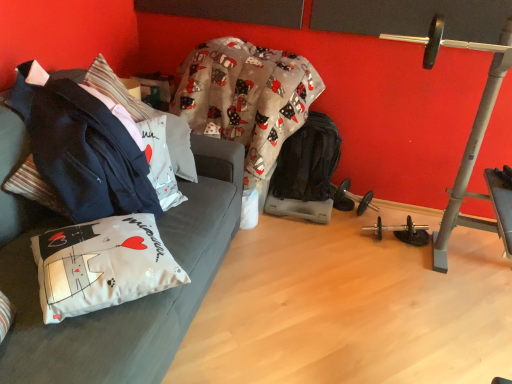
At what (x,y) coordinates should I click in order to perform the action: click on dark blue fabric jacket at left. Please return your answer as a coordinate pair (x, y). Looking at the image, I should click on (80, 151).

What do you see at coordinates (146, 116) in the screenshot?
I see `white fabric pillow at center, which is the 2th pillow from bottom to top` at bounding box center [146, 116].

I want to click on white fabric pillow at lower left, the first pillow positioned from the front, so click(x=102, y=265).

Can you tell me how much white fabric pillow at lower left, marked as the second pillow in a back-to-front arrangement, and patterned fabric blanket at center differ in facing direction?

The facing directions of white fabric pillow at lower left, marked as the second pillow in a back-to-front arrangement, and patterned fabric blanket at center are 133 degrees apart.

Which object is positioned more to the left, white fabric pillow at lower left, marked as the second pillow in a back-to-front arrangement, or patterned fabric blanket at center?

Positioned to the left is white fabric pillow at lower left, marked as the second pillow in a back-to-front arrangement.

Which of these two, white fabric pillow at lower left, marked as the second pillow in a back-to-front arrangement, or patterned fabric blanket at center, is bigger?

patterned fabric blanket at center is bigger.

Choose the correct answer: Is white fabric pillow at lower left, which is counted as the 1th pillow, starting from the bottom, inside patterned fabric blanket at center or outside it?

white fabric pillow at lower left, which is counted as the 1th pillow, starting from the bottom, is located beyond the bounds of patterned fabric blanket at center.

Based on the photo, does dark blue fabric jacket at left have a greater width compared to white fabric couch at left?

No.

Is dark blue fabric jacket at left aimed at white fabric couch at left?

Yes, dark blue fabric jacket at left faces towards white fabric couch at left.

The image size is (512, 384). In the image, there is a dark blue fabric jacket at left. Identify the location of studio couch below it (from the image's perspective). (128, 302).

Is dark blue fabric jacket at left outside of white fabric couch at left?

No, dark blue fabric jacket at left is not outside of white fabric couch at left.

Is white fabric pillow at lower left, marked as the second pillow in a back-to-front arrangement, surrounded by black rubber dumbbell at lower center?

That's incorrect, white fabric pillow at lower left, marked as the second pillow in a back-to-front arrangement, is not inside black rubber dumbbell at lower center.

Is the position of black rubber dumbbell at lower center less distant than that of white fabric pillow at lower left, the first pillow positioned from the front?

No, black rubber dumbbell at lower center is behind white fabric pillow at lower left, the first pillow positioned from the front.

Could you tell me if black rubber dumbbell at lower center is facing white fabric pillow at lower left, marked as the second pillow in a back-to-front arrangement?

Yes, black rubber dumbbell at lower center is oriented towards white fabric pillow at lower left, marked as the second pillow in a back-to-front arrangement.

From a real-world perspective, is black rubber dumbbell at lower center on white fabric pillow at lower left, marked as the second pillow in a back-to-front arrangement?

Actually, black rubber dumbbell at lower center is physically below white fabric pillow at lower left, marked as the second pillow in a back-to-front arrangement, in the real world.

Is patterned fabric blanket at center outside of white fabric pillow at center, the 2th pillow viewed from the front?

patterned fabric blanket at center lies outside white fabric pillow at center, the 2th pillow viewed from the front,'s area.

Is patterned fabric blanket at center directly adjacent to white fabric pillow at center, which is the first pillow from top to bottom?

patterned fabric blanket at center and white fabric pillow at center, which is the first pillow from top to bottom, are clearly separated.

Is patterned fabric blanket at center looking in the opposite direction of white fabric pillow at center, which is the 2th pillow from bottom to top?

That's not correct — patterned fabric blanket at center is not looking away from white fabric pillow at center, which is the 2th pillow from bottom to top.

Can you confirm if patterned fabric blanket at center is bigger than white fabric pillow at center, which is the first pillow from top to bottom?

Correct, patterned fabric blanket at center is larger in size than white fabric pillow at center, which is the first pillow from top to bottom.

Is there a large distance between white fabric pillow at center, which is the first pillow from top to bottom, and white fabric couch at left?

white fabric pillow at center, which is the first pillow from top to bottom, is actually quite close to white fabric couch at left.

Locate an element on the screen. Image resolution: width=512 pixels, height=384 pixels. studio couch below the white fabric pillow at center, which is the first pillow from top to bottom (from the image's perspective) is located at coordinates (128, 302).

Can you confirm if white fabric pillow at center, positioned as the first pillow in back-to-front order, is thinner than white fabric couch at left?

Yes, white fabric pillow at center, positioned as the first pillow in back-to-front order, is thinner than white fabric couch at left.

Considering the sizes of objects white fabric pillow at lower left, marked as the second pillow in a back-to-front arrangement, and dark blue fabric jacket at left in the image provided, who is smaller, white fabric pillow at lower left, marked as the second pillow in a back-to-front arrangement, or dark blue fabric jacket at left?

Smaller between the two is white fabric pillow at lower left, marked as the second pillow in a back-to-front arrangement.

Which object is closer to the camera taking this photo, white fabric pillow at lower left, the second pillow when ordered from top to bottom, or dark blue fabric jacket at left?

white fabric pillow at lower left, the second pillow when ordered from top to bottom, is closer to the camera.

From a real-world perspective, relative to dark blue fabric jacket at left, is white fabric pillow at lower left, the second pillow when ordered from top to bottom, vertically above or below?

white fabric pillow at lower left, the second pillow when ordered from top to bottom, is below dark blue fabric jacket at left.

Which of these two, white fabric pillow at lower left, which is counted as the 1th pillow, starting from the bottom, or dark blue fabric jacket at left, is wider?

white fabric pillow at lower left, which is counted as the 1th pillow, starting from the bottom.

The height and width of the screenshot is (384, 512). What are the coordinates of `jacket behind the white fabric pillow at lower left, the first pillow positioned from the front` in the screenshot? It's located at (80, 151).

Considering the positions of point (105, 213) and point (151, 239), is point (105, 213) closer or farther from the camera than point (151, 239)?

Point (105, 213) is farther from the camera than point (151, 239).

Does dark blue fabric jacket at left have a lesser width compared to white fabric pillow at lower left, the first pillow positioned from the front?

Correct, the width of dark blue fabric jacket at left is less than that of white fabric pillow at lower left, the first pillow positioned from the front.

From the image's perspective, which is above, dark blue fabric jacket at left or white fabric pillow at lower left, which is counted as the 1th pillow, starting from the bottom?

dark blue fabric jacket at left is shown above in the image.

Find the location of a particular element. Image resolution: width=512 pixels, height=384 pixels. the 1st pillow to the left of the patterned fabric blanket at center, counting from the anchor's position is located at coordinates (102, 265).

At what (x,y) coordinates should I click in order to perform the action: click on jacket behind the white fabric couch at left. Please return your answer as a coordinate pair (x, y). Looking at the image, I should click on tap(80, 151).

Consider the image. Based on their spatial positions, is white fabric pillow at lower left, which is counted as the 1th pillow, starting from the bottom, or dark blue fabric jacket at left closer to black rubber dumbbell at lower center?

The object closer to black rubber dumbbell at lower center is dark blue fabric jacket at left.

Looking at the image, which one is located further to white fabric couch at left, black rubber dumbbell at lower center or white fabric pillow at center, which is the first pillow from top to bottom?

black rubber dumbbell at lower center is further to white fabric couch at left.

Considering their positions, is patterned fabric blanket at center positioned closer to black rubber dumbbell at lower center than white fabric pillow at lower left, the first pillow positioned from the front?

Among the two, patterned fabric blanket at center is located nearer to black rubber dumbbell at lower center.

Which object lies nearer to the anchor point white fabric couch at left, white fabric pillow at center, the 2th pillow viewed from the front, or white fabric pillow at lower left, the second pillow when ordered from top to bottom?

white fabric pillow at lower left, the second pillow when ordered from top to bottom, lies closer to white fabric couch at left than the other object.

Looking at this image, from the image, which object appears to be farther from dark blue fabric jacket at left, black rubber dumbbell at lower center or white fabric pillow at lower left, the second pillow when ordered from top to bottom?

black rubber dumbbell at lower center lies further to dark blue fabric jacket at left than the other object.

Looking at the image, which one is located further to dark blue fabric jacket at left, white fabric pillow at center, which is the 2th pillow from bottom to top, or white fabric couch at left?

Among the two, white fabric pillow at center, which is the 2th pillow from bottom to top, is located further to dark blue fabric jacket at left.

Estimate the real-world distances between objects in this image. Which object is further from white fabric pillow at lower left, the first pillow positioned from the front, white fabric pillow at center, which is the first pillow from top to bottom, or dark blue fabric jacket at left?

The object further to white fabric pillow at lower left, the first pillow positioned from the front, is white fabric pillow at center, which is the first pillow from top to bottom.

Based on their spatial positions, is white fabric pillow at center, the 2th pillow viewed from the front, or patterned fabric blanket at center further from dark blue fabric jacket at left?

patterned fabric blanket at center is positioned further to the anchor dark blue fabric jacket at left.

Locate an element on the screen. jacket located between white fabric pillow at lower left, marked as the second pillow in a back-to-front arrangement, and patterned fabric blanket at center in the depth direction is located at coordinates (80, 151).

Locate an element on the screen. blanket between white fabric pillow at center, positioned as the first pillow in back-to-front order, and black rubber dumbbell at lower center, in the horizontal direction is located at coordinates (246, 97).

You are a GUI agent. You are given a task and a screenshot of the screen. Output one action in this format:
    pyautogui.click(x=<x>, y=<y>)
    Task: Click on the pillow between dark blue fabric jacket at left and patterned fabric blanket at center in the front-back direction
    The width and height of the screenshot is (512, 384).
    Given the screenshot: What is the action you would take?
    pyautogui.click(x=146, y=116)

Where is `blanket between white fabric pillow at lower left, marked as the second pillow in a back-to-front arrangement, and black rubber dumbbell at lower center in the front-back direction`? blanket between white fabric pillow at lower left, marked as the second pillow in a back-to-front arrangement, and black rubber dumbbell at lower center in the front-back direction is located at coordinates (246, 97).